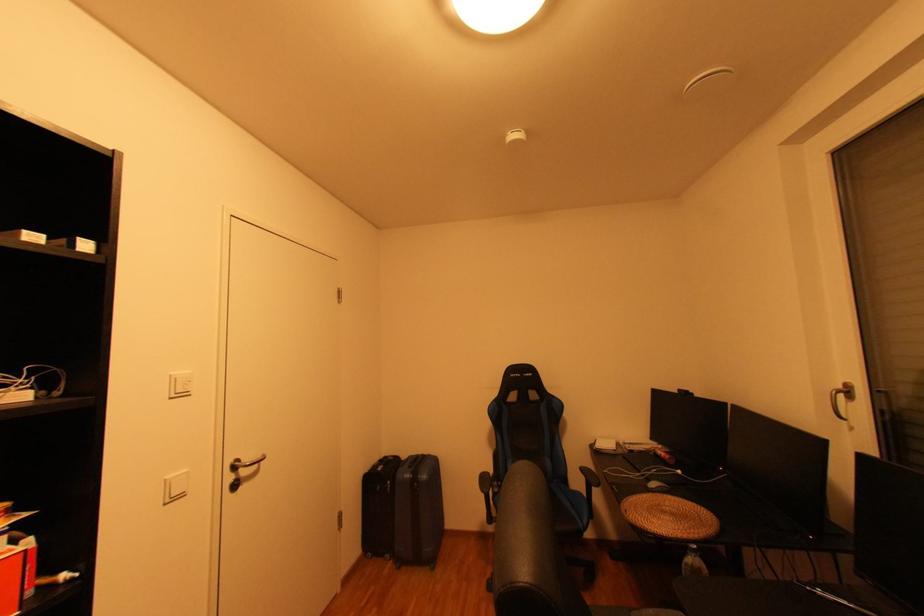
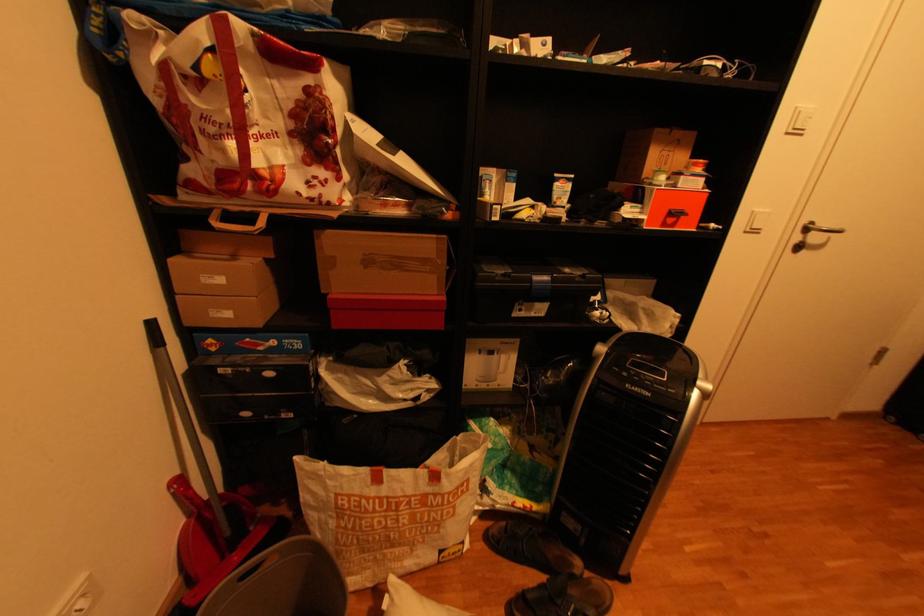
Where in the second image is the point corresponding to the point at 245,469 from the first image?

(816, 230)